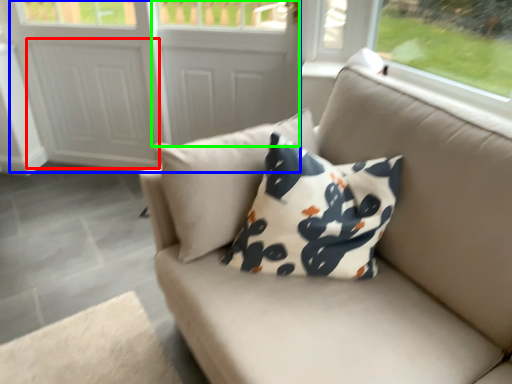
Question: Which object is positioned closest to screen door (highlighted by a red box)? Select from screen door (highlighted by a blue box) and screen door (highlighted by a green box).

Choices:
 (A) screen door
 (B) screen door

Answer: (A)